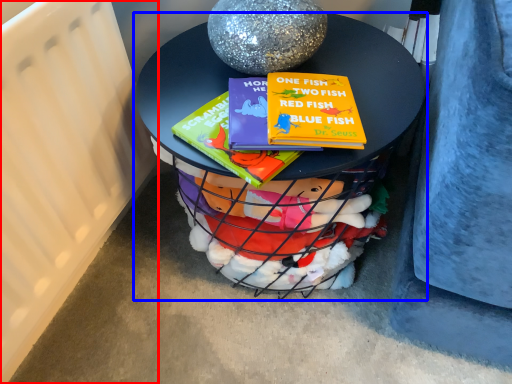
Question: Which object appears farthest to the camera in this image, radiator (highlighted by a red box) or table (highlighted by a blue box)?

Choices:
 (A) radiator
 (B) table

Answer: (B)